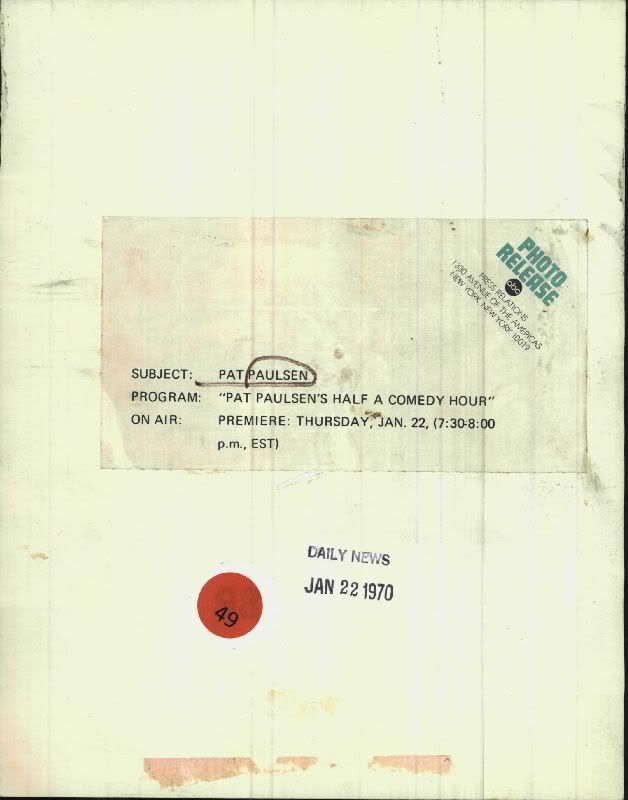
At what (x,y) coordinates should I click in order to perform the action: click on glue stains. Please return your answer as a coordinate pair (x, y). Looking at the image, I should click on (196, 772).